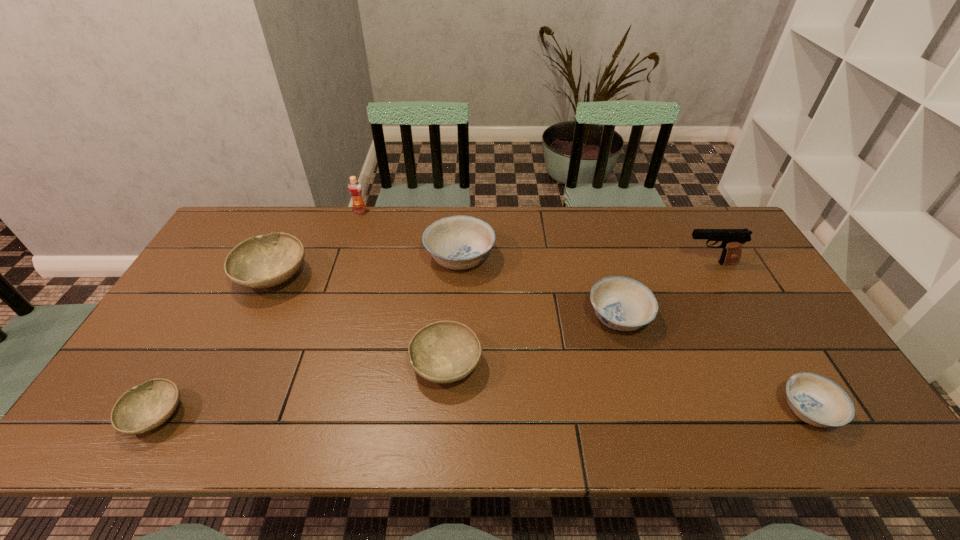
Image resolution: width=960 pixels, height=540 pixels. Find the location of `empty location between the farthest gray bowl and the leftmost blue bowl`. empty location between the farthest gray bowl and the leftmost blue bowl is located at coordinates (367, 267).

This screenshot has width=960, height=540. Find the location of `vacant region between the smallest blue bowl and the farthest gray bowl`. vacant region between the smallest blue bowl and the farthest gray bowl is located at coordinates (540, 343).

Locate which object is the sixth closest to the sixth object from right to left. Please provide its 2D coordinates. Your answer should be formatted as a tuple, i.e. [(x, y)], where the tuple contains the x and y coordinates of a point satisfying the conditions above.

[(732, 240)]

Locate which object is the third closest to the leftmost blue bowl. Please provide its 2D coordinates. Your answer should be formatted as a tuple, i.e. [(x, y)], where the tuple contains the x and y coordinates of a point satisfying the conditions above.

[(354, 187)]

Identify which bowl is the fourth nearest to the leftmost blue bowl. Please provide its 2D coordinates. Your answer should be formatted as a tuple, i.e. [(x, y)], where the tuple contains the x and y coordinates of a point satisfying the conditions above.

[(144, 407)]

Image resolution: width=960 pixels, height=540 pixels. Identify the location of bowl object that ranks as the fifth closest to the rightmost blue bowl. (144, 407).

At what (x,y) coordinates should I click in order to perform the action: click on the closest blue bowl to the orange juice. Please return your answer as a coordinate pair (x, y). Image resolution: width=960 pixels, height=540 pixels. Looking at the image, I should click on (459, 242).

This screenshot has width=960, height=540. I want to click on blue bowl that stands as the third closest to the smallest gray bowl, so click(x=818, y=401).

I want to click on gray bowl that can be found as the third closest to the third object from left to right, so pos(144,407).

Identify the location of the third closest gray bowl to the pistol. The width and height of the screenshot is (960, 540). (144, 407).